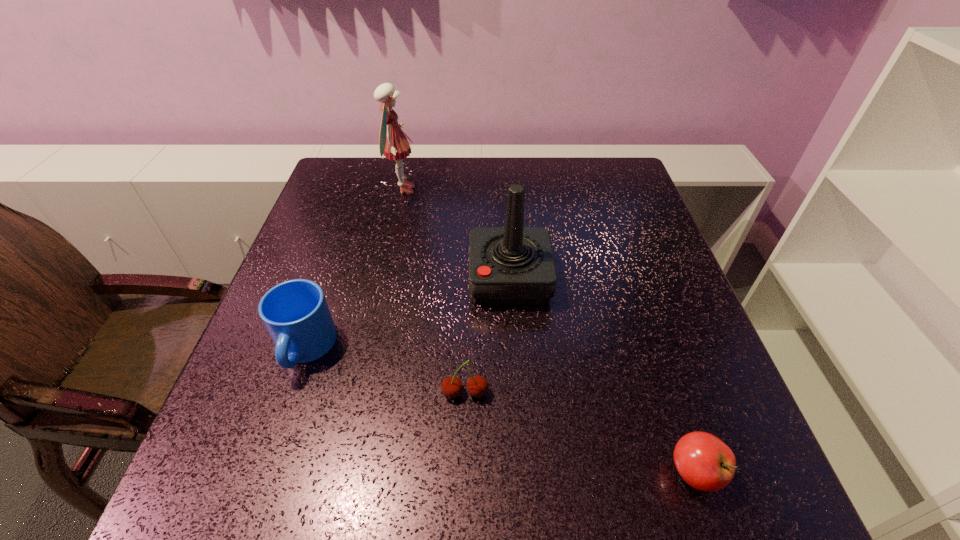
This screenshot has width=960, height=540. Identify the location of free space that satisfies the following two spatial constraints: 1. on the surface of the cherry; 2. on the left side of the rightmost object. (463, 472).

Locate an element on the screen. The image size is (960, 540). free spot that satisfies the following two spatial constraints: 1. on the front-facing side of the second object from left to right; 2. on the side of the leftmost object with the handle is located at coordinates (367, 349).

Identify the location of free space in the image that satisfies the following two spatial constraints: 1. on the front-facing side of the fourth object from right to left; 2. on the side of the leftmost object with the handle. (367, 349).

The image size is (960, 540). Identify the location of vacant space that satisfies the following two spatial constraints: 1. on the surface of the cherry; 2. on the right side of the rightmost object. (463, 472).

Where is `vacant region that satisfies the following two spatial constraints: 1. on the surface of the nearest object; 2. on the left side of the cherry`? This screenshot has height=540, width=960. vacant region that satisfies the following two spatial constraints: 1. on the surface of the nearest object; 2. on the left side of the cherry is located at coordinates (463, 472).

You are a GUI agent. You are given a task and a screenshot of the screen. Output one action in this format:
    pyautogui.click(x=<x>, y=<y>)
    Task: Click on the free space in the image that satisfies the following two spatial constraints: 1. on the front-facing side of the second farthest object; 2. on the surface of the cherry
    This screenshot has width=960, height=540.
    Given the screenshot: What is the action you would take?
    pyautogui.click(x=517, y=393)

Locate an element on the screen. Image resolution: width=960 pixels, height=540 pixels. free space in the image that satisfies the following two spatial constraints: 1. on the surface of the shortest object; 2. on the left side of the cherry is located at coordinates (463, 472).